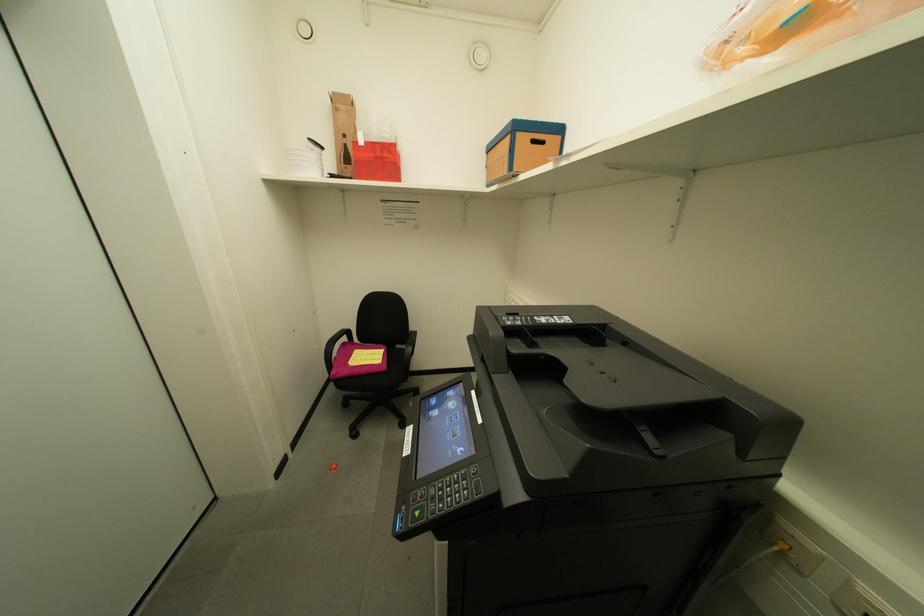
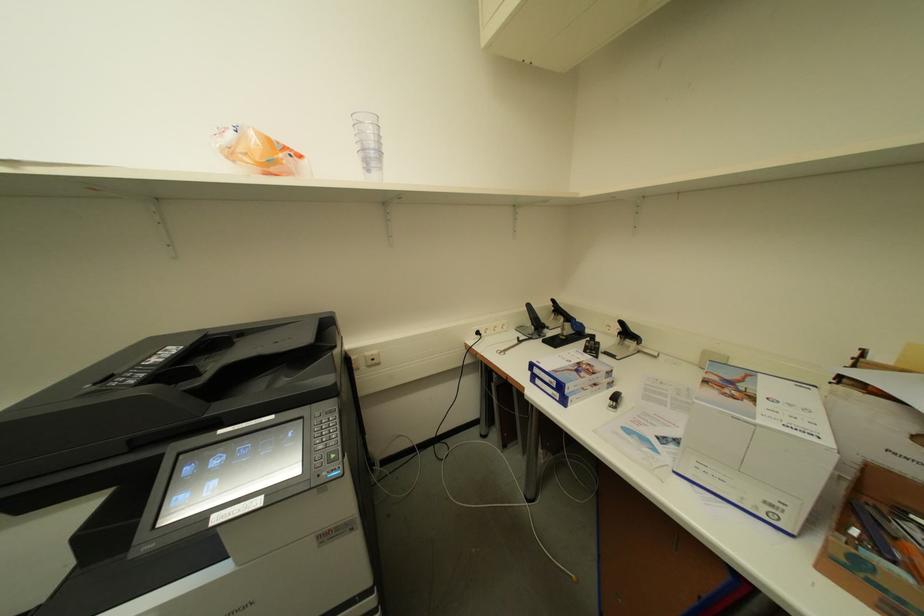
The images are taken continuously from a first-person perspective. In which direction is your viewpoint rotating?

The rotation direction of the camera is right-down.